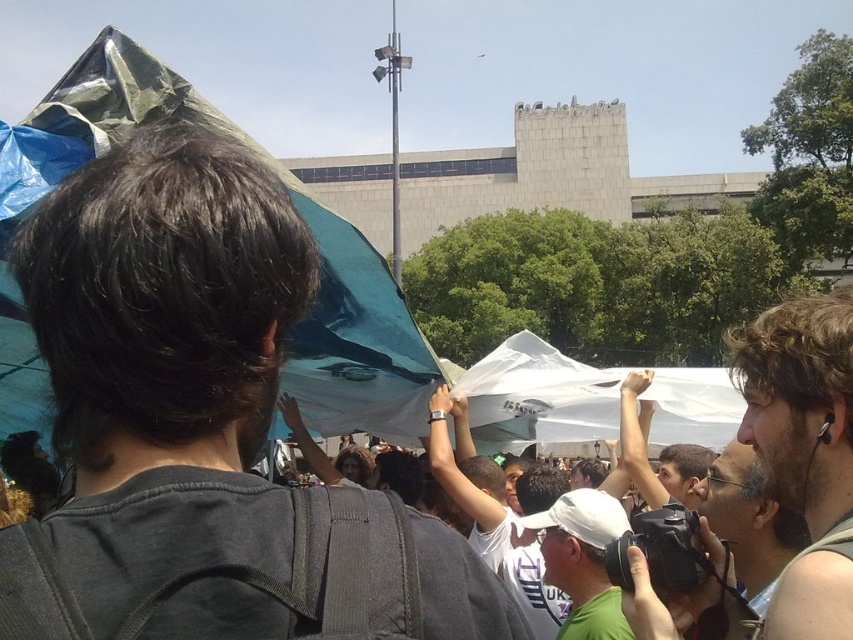
Question: Which point is closer to the camera?

Choices:
 (A) gray fabric earphones at right
 (B) gray tank top at lower right

Answer: (A)

Question: Observing the image, what is the correct spatial positioning of gray fabric earphones at right in reference to white matte cap at center?

Choices:
 (A) right
 (B) left

Answer: (A)

Question: Considering the real-world distances, which object is closest to the gray tank top at lower right?

Choices:
 (A) white matte cap at center
 (B) gray fabric earphones at right

Answer: (B)

Question: Which object is closer to the camera taking this photo?

Choices:
 (A) white matte cap at center
 (B) gray fabric earphones at right

Answer: (B)

Question: Can you confirm if gray fabric earphones at right is wider than gray tank top at lower right?

Choices:
 (A) yes
 (B) no

Answer: (A)

Question: Can you confirm if white matte cap at center is smaller than gray tank top at lower right?

Choices:
 (A) no
 (B) yes

Answer: (B)